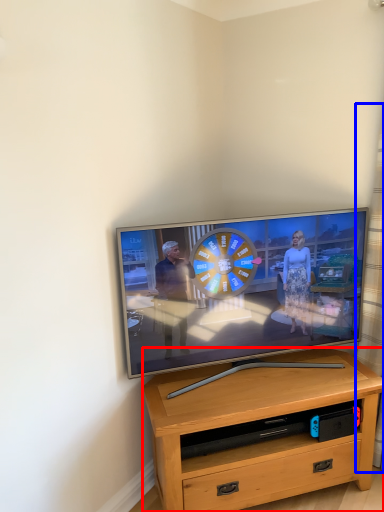
Question: Which of the following is the closest to the observer, desk (highlighted by a red box) or curtain (highlighted by a blue box)?

Choices:
 (A) desk
 (B) curtain

Answer: (B)